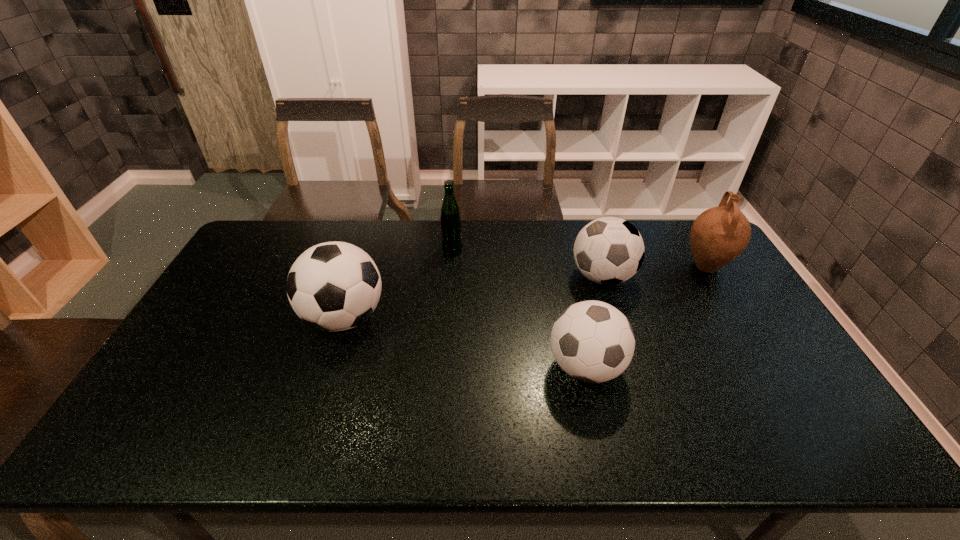
Identify which soccer ball is the second nearest to the leftmost object. Please provide its 2D coordinates. Your answer should be formatted as a tuple, i.e. [(x, y)], where the tuple contains the x and y coordinates of a point satisfying the conditions above.

[(609, 250)]